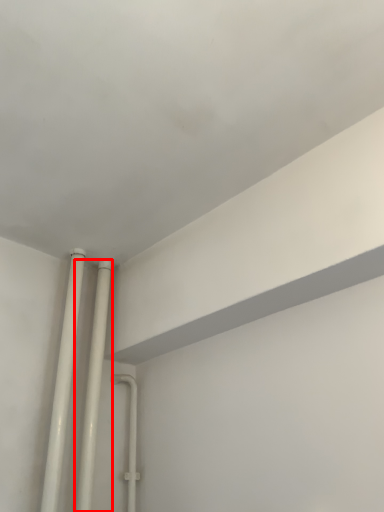
Question: Considering the relative positions of pipe (annotated by the red box) and pipe in the image provided, where is pipe (annotated by the red box) located with respect to the staircase?

Choices:
 (A) right
 (B) left

Answer: (A)